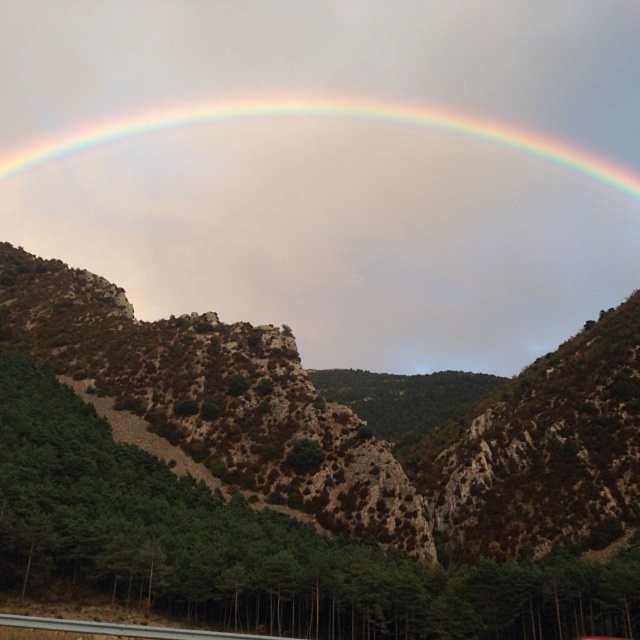
Which is more to the right, rainbow at upper center or gray concrete highway at lower center?

Positioned to the right is rainbow at upper center.

Between rainbow at upper center and gray concrete highway at lower center, which one is positioned lower?

gray concrete highway at lower center is lower down.

Find the location of `rainbow at upper center`. rainbow at upper center is located at coordinates (314, 115).

Find the location of a particular element. rainbow at upper center is located at coordinates (314, 115).